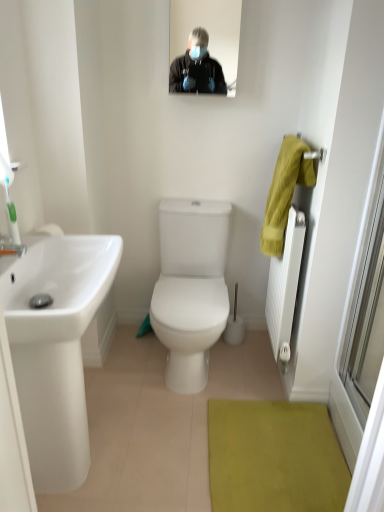
Question: Does transparent glass door at right have a greater height compared to matte black mirror at upper center?

Choices:
 (A) yes
 (B) no

Answer: (A)

Question: Is transparent glass door at right at the right side of matte black mirror at upper center?

Choices:
 (A) yes
 (B) no

Answer: (A)

Question: From the image's perspective, would you say transparent glass door at right is shown under matte black mirror at upper center?

Choices:
 (A) yes
 (B) no

Answer: (A)

Question: From the image's perspective, is transparent glass door at right on top of matte black mirror at upper center?

Choices:
 (A) yes
 (B) no

Answer: (B)

Question: Is transparent glass door at right oriented towards matte black mirror at upper center?

Choices:
 (A) yes
 (B) no

Answer: (B)

Question: Considering the positions of yellow fabric hand towel at right and white textured radiator at right in the image, is yellow fabric hand towel at right bigger or smaller than white textured radiator at right?

Choices:
 (A) small
 (B) big

Answer: (A)

Question: From their relative heights in the image, would you say yellow fabric hand towel at right is taller or shorter than white textured radiator at right?

Choices:
 (A) short
 (B) tall

Answer: (A)

Question: Do you think yellow fabric hand towel at right is within white textured radiator at right, or outside of it?

Choices:
 (A) outside
 (B) inside

Answer: (A)

Question: Does point (296, 163) appear closer or farther from the camera than point (271, 293)?

Choices:
 (A) farther
 (B) closer

Answer: (B)

Question: Based on their positions, is transparent glass door at right located to the left or right of matte black mirror at upper center?

Choices:
 (A) left
 (B) right

Answer: (B)

Question: From the image's perspective, relative to matte black mirror at upper center, is transparent glass door at right above or below?

Choices:
 (A) above
 (B) below

Answer: (B)

Question: Is point (345, 331) closer or farther from the camera than point (226, 19)?

Choices:
 (A) farther
 (B) closer

Answer: (B)

Question: From their relative heights in the image, would you say transparent glass door at right is taller or shorter than matte black mirror at upper center?

Choices:
 (A) short
 (B) tall

Answer: (B)

Question: In terms of width, does white glossy sink at left look wider or thinner when compared to matte black mirror at upper center?

Choices:
 (A) wide
 (B) thin

Answer: (A)

Question: From the image's perspective, is white glossy sink at left located above or below matte black mirror at upper center?

Choices:
 (A) above
 (B) below

Answer: (B)